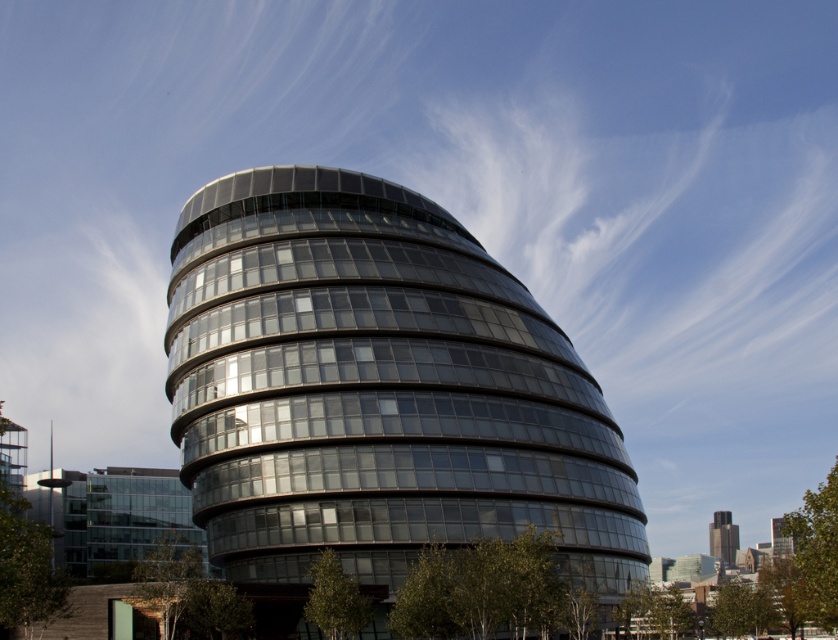
You are standing in front of the transparent glass building at center and want to take a photo of the dark gray concrete tower at lower right. Since the building is in the way, will you need to move to the side to get a clear shot?

The transparent glass building at center is taller than the dark gray concrete tower at lower right, so you can still take a photo of the dark gray concrete tower at lower right without moving to the side because the tower is shorter and visible below the glass building.

You are an architect analyzing the spatial relationship between the transparent glass building at center and the dark gray concrete tower at lower right. Which building is placed higher in the image?

The transparent glass building at center is positioned over dark gray concrete tower at lower right, meaning it is placed higher in the image.

You are standing at a viewpoint where the transparent glass building at center is visible. If you want to take a photo of the building with your camera, which is 45.95 meters away from the building, will you need to adjust the focus to infinity?

The transparent glass building at center and camera are 45.95 meters apart from each other. Most cameras require focusing beyond 40 meters to infinity, so you should adjust the focus to infinity to capture the building clearly.